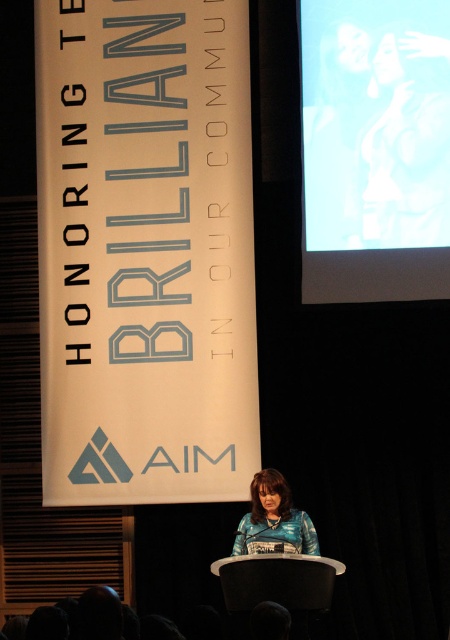
Which of these two, white glossy screen at upper right or blue textured shirt at center, stands shorter?

blue textured shirt at center

Is point (333, 81) behind point (257, 504)?

Yes, it is behind point (257, 504).

In order to click on white glossy screen at upper right in this screenshot , I will do `click(374, 148)`.